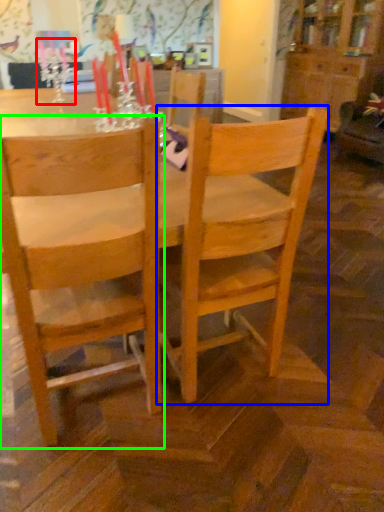
Question: Which is farther away from candle holder (highlighted by a red box)? chair (highlighted by a blue box) or chair (highlighted by a green box)?

Choices:
 (A) chair
 (B) chair

Answer: (A)